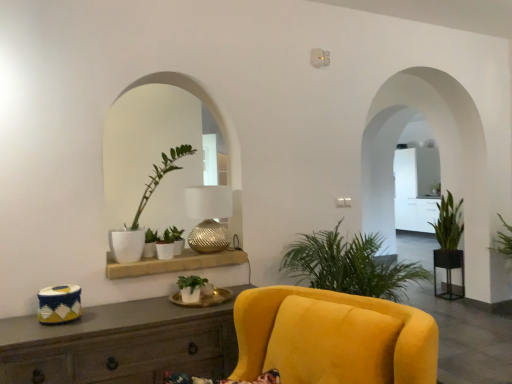
The height and width of the screenshot is (384, 512). Identify the location of free spot in front of green matte plant at center, placed as the 4th houseplant when sorted from left to right. (191, 310).